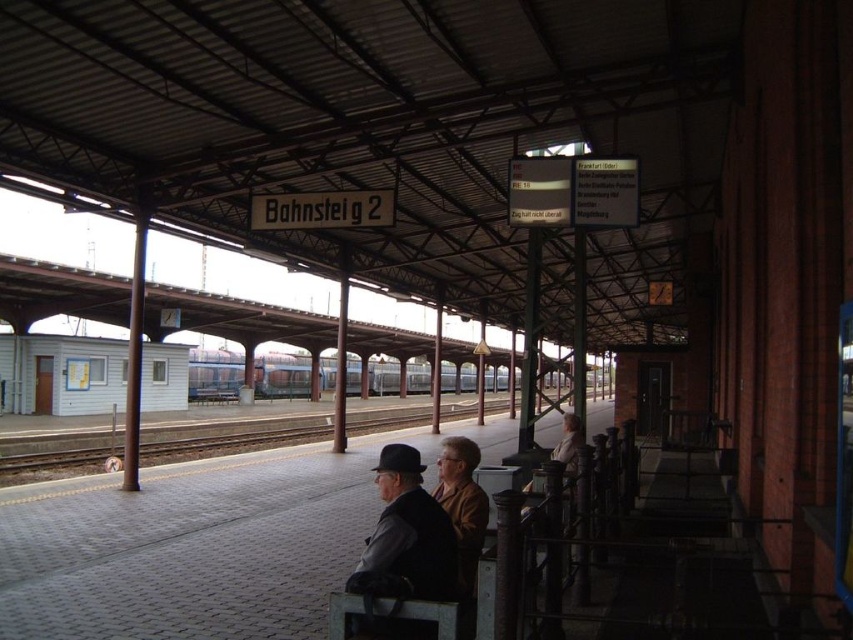
You are a photographer trying to capture a photo of the blue metallic train at center without including the dark gray wool hat at center in the frame. Given their sizes, is this possible?

The dark gray wool hat at center occupies less space than blue metallic train at center, so it is possible to capture the blue metallic train at center without including the dark gray wool hat at center in the frame by adjusting the camera angle to exclude the smaller object.

You are a passenger on the platform waiting for the train. You notice the dark gray wool hat at center and the blue metallic train at center. Which object is closer to you from your current position?

The dark gray wool hat at center is closer to you because it is in front of the blue metallic train at center, indicating it is nearer in the line of sight.

You are standing at the point marked by the coordinates point (405, 536) in the train station platform scene. What object is located exactly at that point?

The point (405, 536) corresponds to the dark gray wool hat at center.